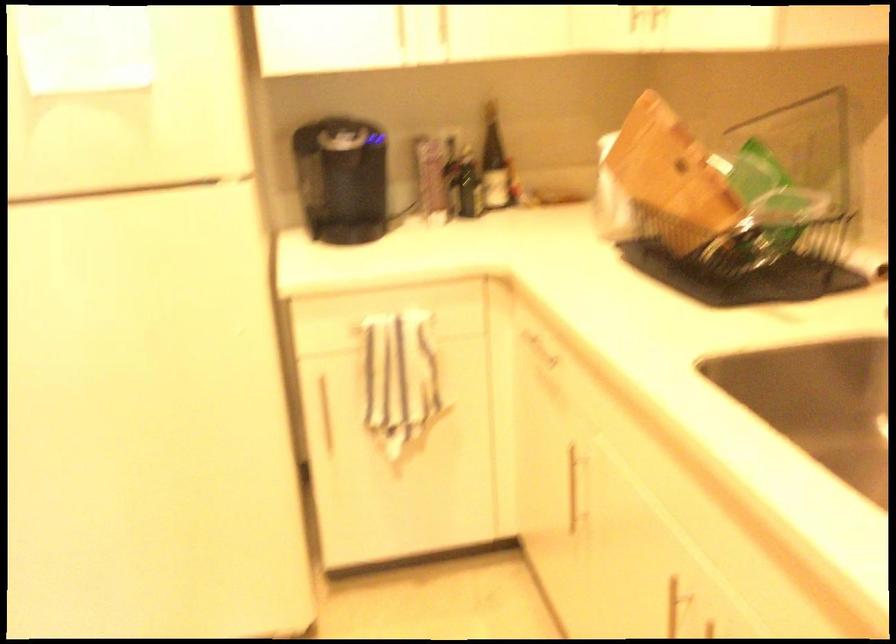
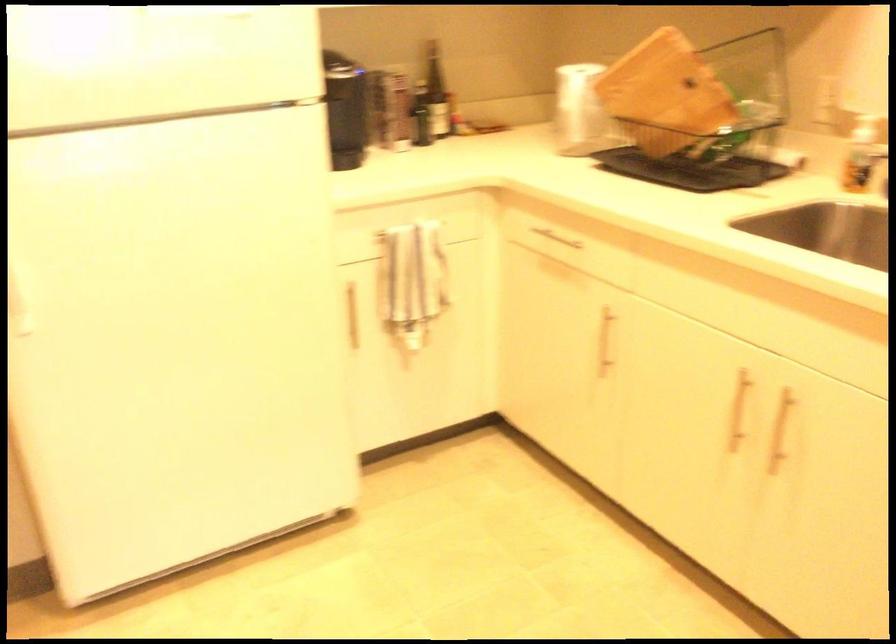
In the second image, find the point that corresponds to point 670,184 in the first image.

(665, 93)